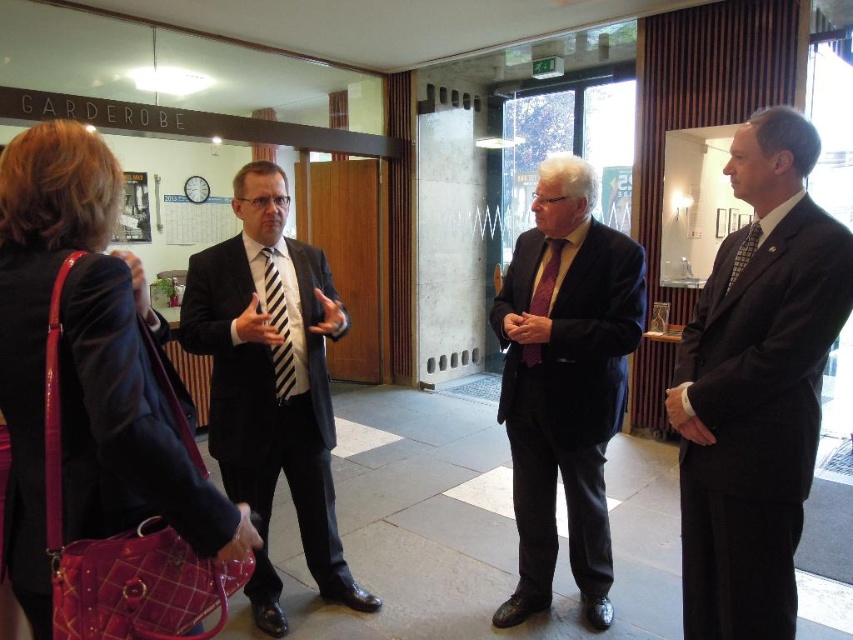
Between black striped tie at center and checkered fabric tie at right, which one appears on the right side from the viewer's perspective?

Positioned to the right is checkered fabric tie at right.

How far apart are black striped tie at center and checkered fabric tie at right?

The distance of black striped tie at center from checkered fabric tie at right is 1.36 meters.

Where is `black striped tie at center`? This screenshot has height=640, width=853. black striped tie at center is located at coordinates (277, 328).

Between dark suit at center and black striped tie at center, which one is positioned lower?

dark suit at center is below.

Between dark suit at center and black striped tie at center, which one appears on the right side from the viewer's perspective?

From the viewer's perspective, dark suit at center appears more on the right side.

Does point (786, 132) come behind point (292, 388)?

No, it is not.

Identify the location of dark suit at center. (756, 388).

Image resolution: width=853 pixels, height=640 pixels. Identify the location of velvet purple tie at center. (564, 381).

Does velvet purple tie at center appear on the right side of purple silk tie at center?

Yes, velvet purple tie at center is to the right of purple silk tie at center.

You are a GUI agent. You are given a task and a screenshot of the screen. Output one action in this format:
    pyautogui.click(x=<x>, y=<y>)
    Task: Click on the velvet purple tie at center
    The height and width of the screenshot is (640, 853).
    Given the screenshot: What is the action you would take?
    pyautogui.click(x=564, y=381)